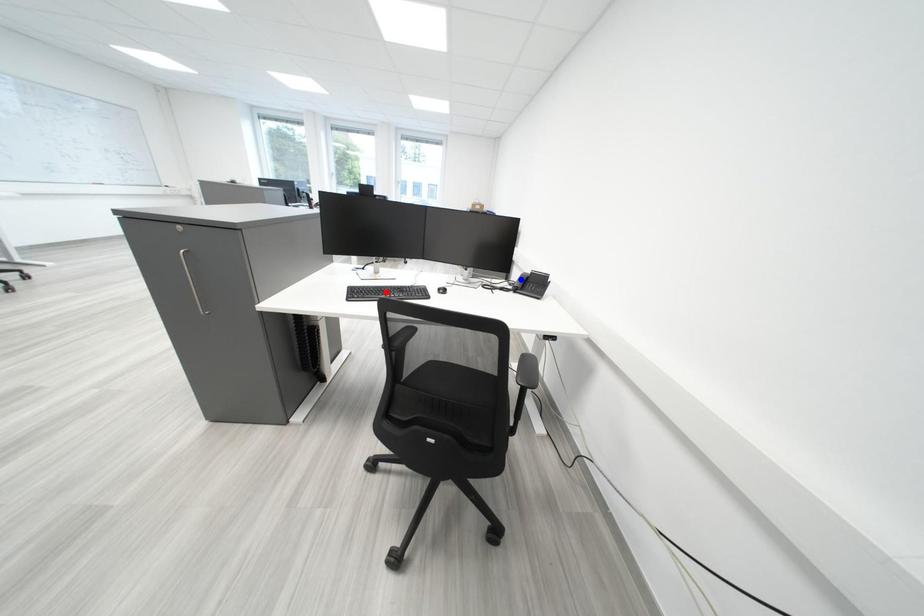
Question: Two points are marked on the image. Which point is closer to the camera?

Choices:
 (A) Blue point is closer.
 (B) Red point is closer.

Answer: (B)